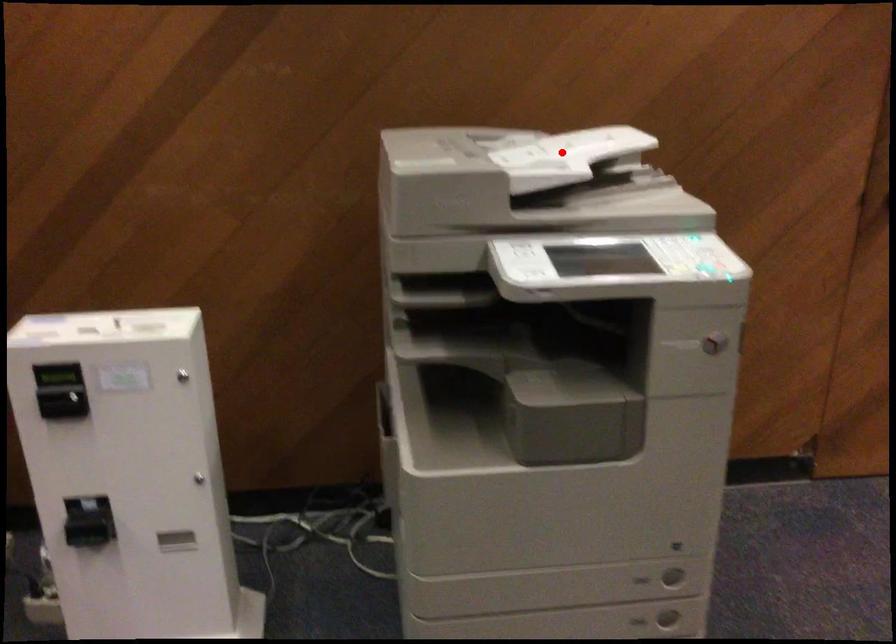
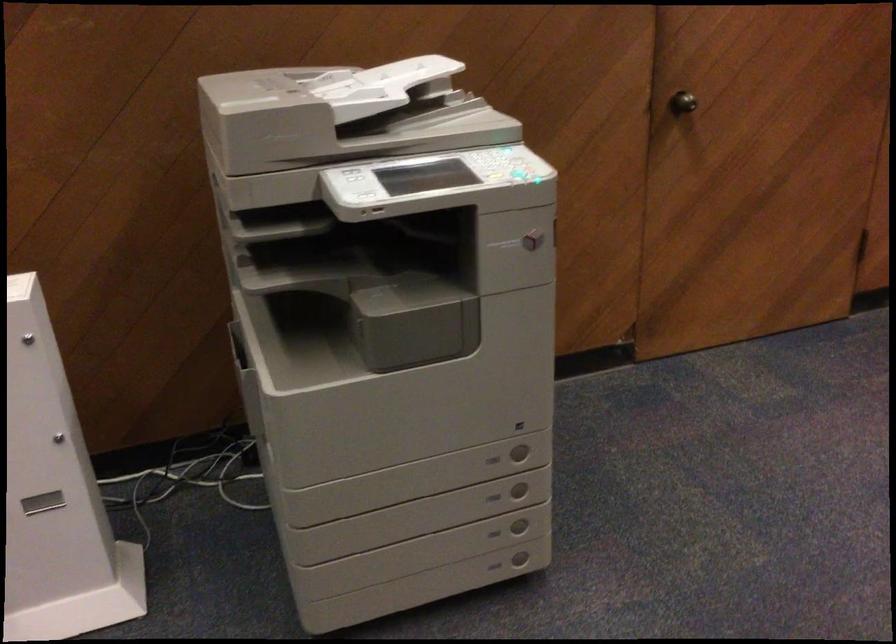
Locate, in the second image, the point that corresponds to the highlighted location in the first image.

(376, 86)